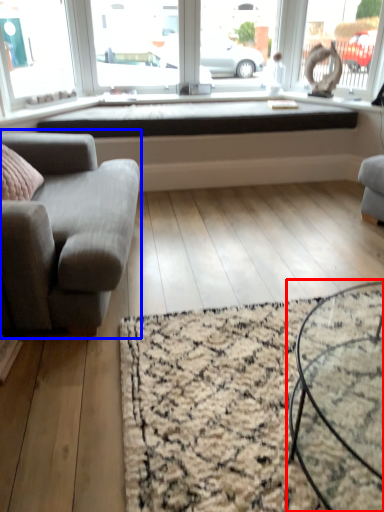
Question: Which object is further to the camera taking this photo, coffee table (highlighted by a red box) or studio couch (highlighted by a blue box)?

Choices:
 (A) coffee table
 (B) studio couch

Answer: (B)